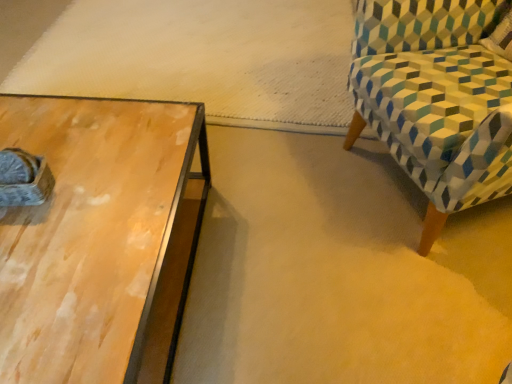
Where is `patterned fabric chair at upper right`? Image resolution: width=512 pixels, height=384 pixels. patterned fabric chair at upper right is located at coordinates (437, 98).

Measure the distance between patterned fabric chair at upper right and camera.

patterned fabric chair at upper right is 94.12 centimeters from camera.

Describe the element at coordinates (437, 98) in the screenshot. This screenshot has height=384, width=512. I see `patterned fabric chair at upper right` at that location.

You are a GUI agent. You are given a task and a screenshot of the screen. Output one action in this format:
    pyautogui.click(x=<x>, y=<y>)
    Task: Click on the patterned fabric chair at upper right
    This screenshot has height=384, width=512.
    Given the screenshot: What is the action you would take?
    [x=437, y=98]